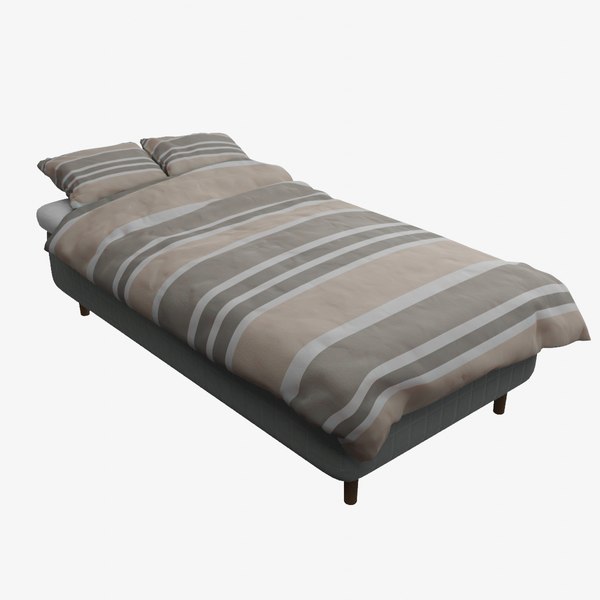
Where is `bed legs`? The width and height of the screenshot is (600, 600). bed legs is located at coordinates (356, 492), (499, 405), (88, 313).